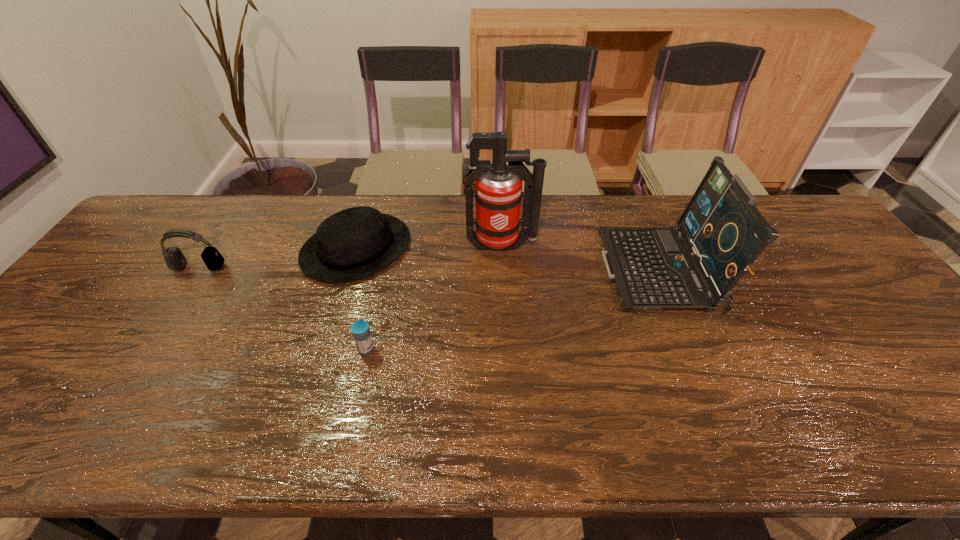
The width and height of the screenshot is (960, 540). I want to click on blank space located on the front-facing side of the fourth shortest object, so click(507, 272).

Identify the location of free space located 0.120m on the front-facing side of the fourth shortest object. (563, 272).

At what (x,y) coordinates should I click in order to perform the action: click on vacant space located 0.100m on the front-facing side of the fourth shortest object. Please return your answer as a coordinate pair (x, y). Looking at the image, I should click on (570, 272).

Find the location of `vacant region located 0.310m on the headband of the headset`. vacant region located 0.310m on the headband of the headset is located at coordinates (135, 364).

You are a GUI agent. You are given a task and a screenshot of the screen. Output one action in this format:
    pyautogui.click(x=<x>, y=<y>)
    Task: Click on the free spot located 0.220m on the front of the fourth tallest object
    The width and height of the screenshot is (960, 540).
    Given the screenshot: What is the action you would take?
    pyautogui.click(x=325, y=353)

This screenshot has height=540, width=960. Identify the location of vacant space located 0.390m on the right of the medicine. (537, 349).

Identify the location of fire extinguisher located at the far edge. The height and width of the screenshot is (540, 960). (498, 187).

This screenshot has width=960, height=540. Identify the location of laptop computer that is at the far edge. (724, 232).

At what (x,y) coordinates should I click in order to perform the action: click on fedora situated at the far edge. Please return your answer as a coordinate pair (x, y). Image resolution: width=960 pixels, height=540 pixels. Looking at the image, I should click on (356, 242).

In the image, there is a desktop. Identify the location of blank space at the far edge. (631, 205).